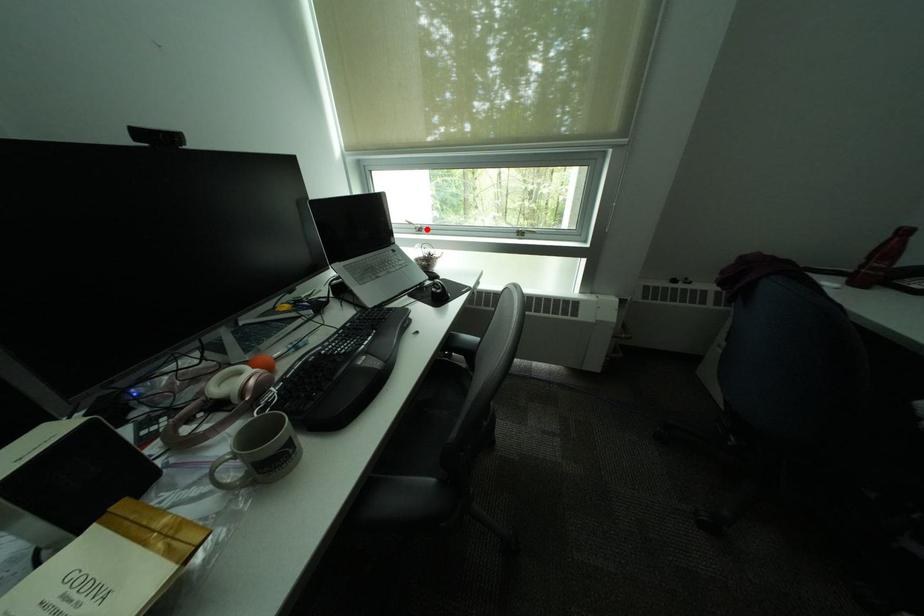
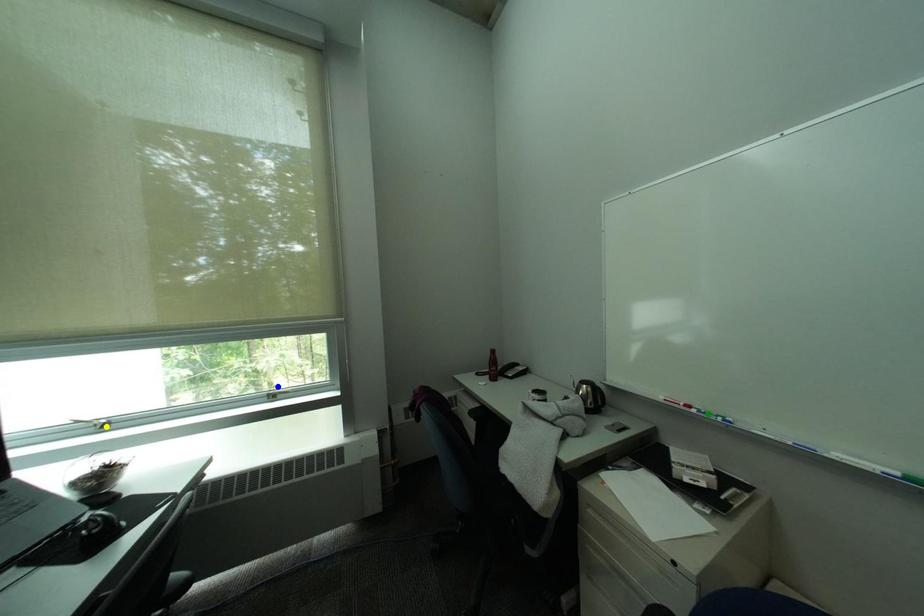
Question: I am providing you with two images of the same scene from different viewpoints. A red point is marked on the first image. You are given multiple points on the second image. In image 2, which mark is for the same physical point as the one in image 1?

Choices:
 (A) green point
 (B) blue point
 (C) yellow point

Answer: (C)